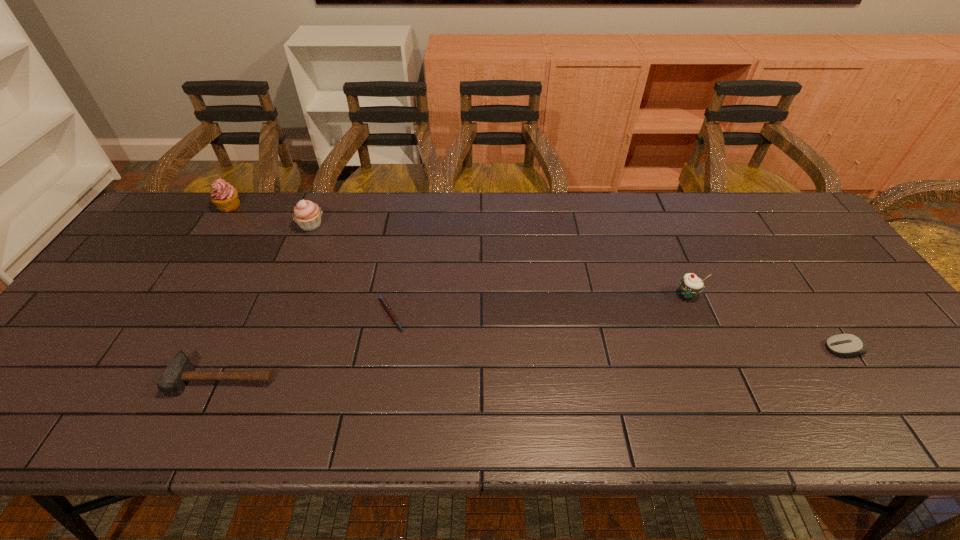
What are the coordinates of `the leftmost cupcake` in the screenshot? It's located at (224, 196).

Where is `the leftmost object`? the leftmost object is located at coordinates (224, 196).

Identify the location of the second nearest cupcake. (307, 215).

Where is `the fifth nearest object`? Image resolution: width=960 pixels, height=540 pixels. the fifth nearest object is located at coordinates (307, 215).

Find the location of `the nearest cupcake`. the nearest cupcake is located at coordinates (690, 285).

Image resolution: width=960 pixels, height=540 pixels. In order to click on the rightmost cupcake in this screenshot , I will do `click(690, 285)`.

You are a GUI agent. You are given a task and a screenshot of the screen. Output one action in this format:
    pyautogui.click(x=<x>, y=<y>)
    Task: Click on the hammer
    This screenshot has height=540, width=960.
    Given the screenshot: What is the action you would take?
    pyautogui.click(x=180, y=370)

The width and height of the screenshot is (960, 540). Find the location of `the rightmost object`. the rightmost object is located at coordinates (842, 344).

The image size is (960, 540). What are the coordinates of `computer equipment` in the screenshot? It's located at (842, 344).

At what (x,y) coordinates should I click in order to perform the action: click on pen. Please return your answer as a coordinate pair (x, y). The height and width of the screenshot is (540, 960). Looking at the image, I should click on (387, 308).